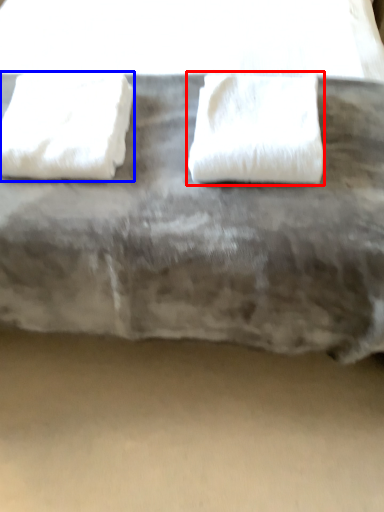
Question: Which point is further to the camera, towel (highlighted by a red box) or towel (highlighted by a blue box)?

Choices:
 (A) towel
 (B) towel

Answer: (B)